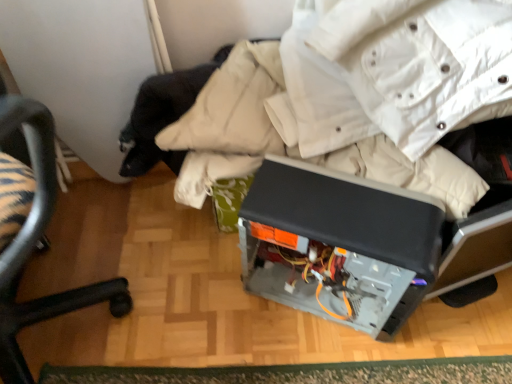
Find the location of a particular element. This screenshot has width=512, height=384. vacant area situated below green textured mat at lower center (from a real-world perspective) is located at coordinates (316, 371).